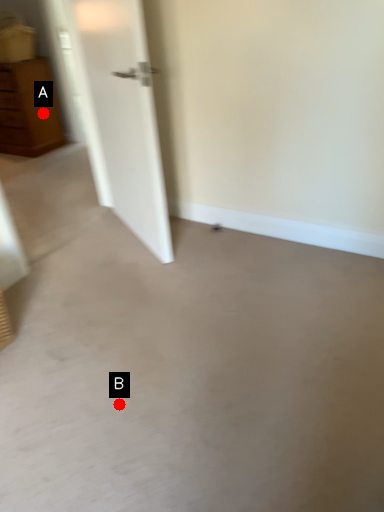
Question: Two points are circled on the image, labeled by A and B beside each circle. Which point appears closest to the camera in this image?

Choices:
 (A) A is closer
 (B) B is closer

Answer: (B)